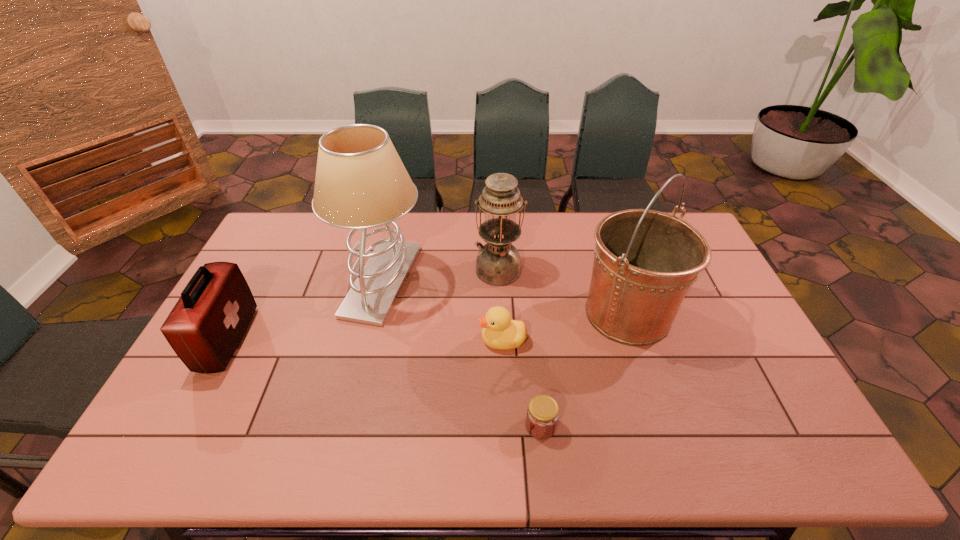
Find the location of `free space located 0.210m on the right of the oil lamp`. free space located 0.210m on the right of the oil lamp is located at coordinates (583, 269).

What are the coordinates of `blank space located on the side of the first aid kit with the cross symbol` in the screenshot? It's located at (376, 339).

Locate an element on the screen. This screenshot has width=960, height=540. free space located at the beak of the second shortest object is located at coordinates (417, 340).

You are a GUI agent. You are given a task and a screenshot of the screen. Output one action in this format:
    pyautogui.click(x=<x>, y=<y>)
    Task: Click on the vacant space situated at the beak of the second shortest object
    This screenshot has width=960, height=540.
    Given the screenshot: What is the action you would take?
    pyautogui.click(x=447, y=340)

Identify the location of vacant region located at the beak of the second shortest object. (427, 340).

Locate an element on the screen. The height and width of the screenshot is (540, 960). vacant area situated 0.110m on the left of the shortest object is located at coordinates (480, 426).

Find the location of a particular element. object that is at the far edge is located at coordinates (361, 182).

Find the location of a particular element. This screenshot has height=540, width=960. object that is at the near edge is located at coordinates [x=542, y=413].

You are a GUI agent. You are given a task and a screenshot of the screen. Output one action in this format:
    pyautogui.click(x=<x>, y=<y>)
    Task: Click on the object located in the left edge section of the desktop
    The image size is (960, 540).
    Given the screenshot: What is the action you would take?
    pyautogui.click(x=206, y=325)

This screenshot has width=960, height=540. Find the location of `free point at the far edge`. free point at the far edge is located at coordinates (595, 222).